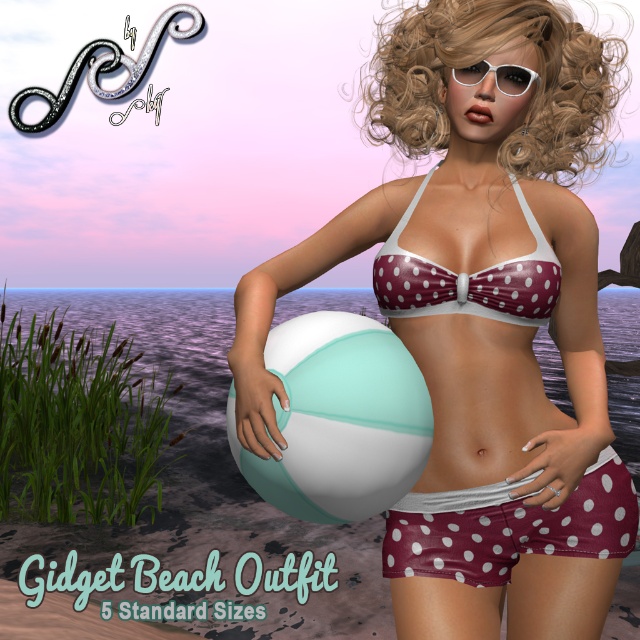
You are a photographer trying to capture the maroon polka dot bikini top at center. However, the blonde curly hair at upper center is blocking your view. Can you adjust your position to see the bikini top clearly?

The maroon polka dot bikini top at center is behind the blonde curly hair at upper center, so moving your position slightly downward or to the side might allow you to see the bikini top without obstruction.

You are a photographer trying to capture the perfect shot of the beach scene. You notice two points in the image at coordinates point (413, 314) and point (518, 93). Which point is closer to your camera lens?

Point (518, 93) is closer to the camera lens because it is less further than point (413, 314).

You are a photographer taking a picture of the maroon polka dot bikini top at center and the white matte glasses at upper center. Which object should you focus on first if you want to capture both in the same frame without moving the camera?

You should focus on the maroon polka dot bikini top at center first because it is positioned to the left of the white matte glasses at upper center, so adjusting focus from left to right would ensure both are captured.